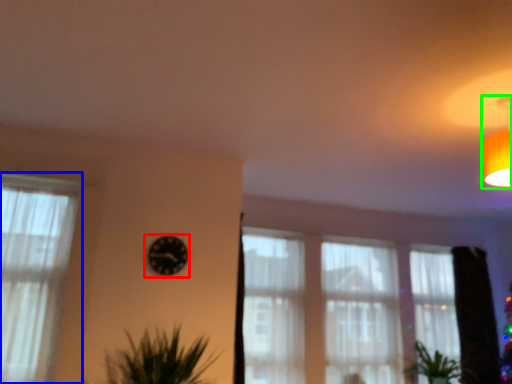
Question: Based on their relative distances, which object is farther from clock (highlighted by a red box)? Choose from curtain (highlighted by a blue box) and light fixture (highlighted by a green box).

Choices:
 (A) curtain
 (B) light fixture

Answer: (B)